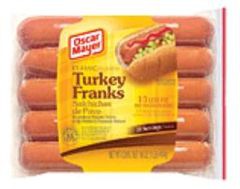
You are a GUI agent. You are given a task and a screenshot of the screen. Output one action in this format:
    pyautogui.click(x=<x>, y=<y>)
    Task: Click on the plastic container
    This screenshot has width=240, height=189.
    Given the screenshot: What is the action you would take?
    pyautogui.click(x=214, y=142)